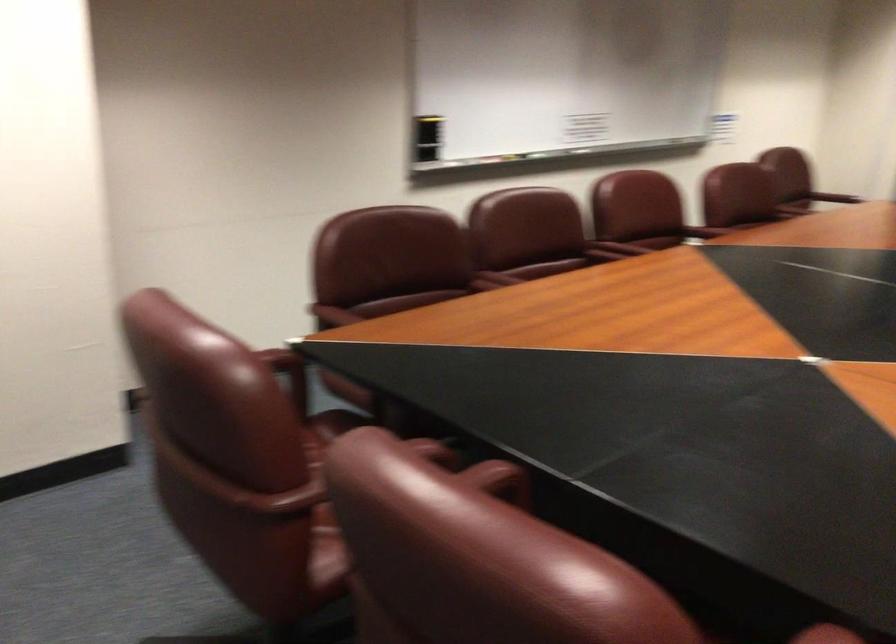
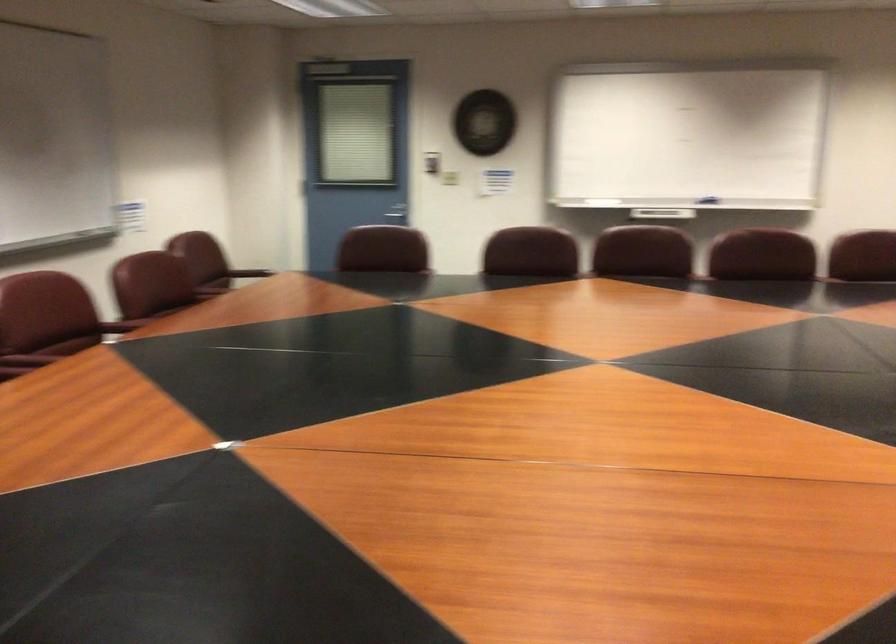
Question: The camera is either moving clockwise (left) or counter-clockwise (right) around the object. The first image is from the beginning of the video and the second image is from the end. Is the camera moving left or right when shooting the video?

Choices:
 (A) Left
 (B) Right

Answer: (A)